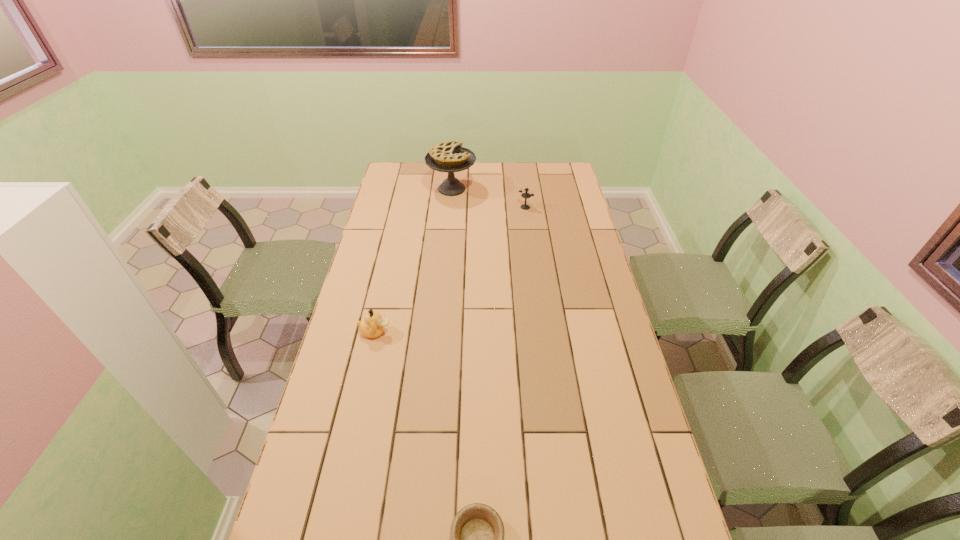
Locate an element on the screen. The width and height of the screenshot is (960, 540). the farthest object is located at coordinates (450, 157).

Locate an element on the screen. This screenshot has height=540, width=960. pie is located at coordinates (450, 157).

Locate an element on the screen. The width and height of the screenshot is (960, 540). the third nearest object is located at coordinates (525, 195).

Identify the location of the rightmost object. (525, 195).

Where is `the second shortest object`? the second shortest object is located at coordinates (373, 326).

Locate an element on the screen. the leftmost object is located at coordinates (373, 326).

You are a GUI agent. You are given a task and a screenshot of the screen. Output one action in this format:
    pyautogui.click(x=<x>, y=<y>)
    Task: Click on the vacant space located on the cut side of the pie
    
    Given the screenshot: What is the action you would take?
    pyautogui.click(x=508, y=189)

In order to click on free space located 0.270m on the back of the second farthest object in this screenshot , I will do `click(521, 174)`.

Image resolution: width=960 pixels, height=540 pixels. I want to click on free space located on the face of the second shortest object, so click(x=455, y=332).

Locate an element on the screen. This screenshot has width=960, height=540. object that is at the far edge is located at coordinates (450, 157).